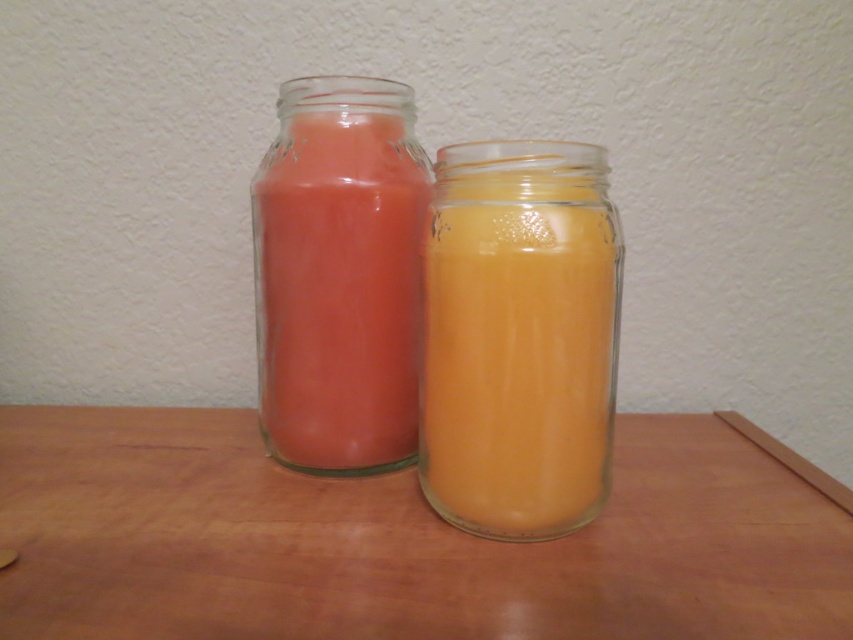
Which is above, wooden table at center or translucent glass candle at center?

Positioned higher is translucent glass candle at center.

Does wooden table at center appear on the right side of translucent glass candle at center?

In fact, wooden table at center is to the left of translucent glass candle at center.

Which is in front, point (828, 529) or point (457, 445)?

Point (457, 445)

This screenshot has height=640, width=853. What are the coordinates of `wooden table at center` in the screenshot? It's located at [396, 541].

Does point (198, 609) lie behind point (335, 464)?

No, (198, 609) is in front of (335, 464).

Between wooden table at center and matte glass jar at center, which one appears on the left side from the viewer's perspective?

wooden table at center

I want to click on wooden table at center, so click(396, 541).

Is point (508, 461) positioned after point (323, 365)?

No.

Image resolution: width=853 pixels, height=640 pixels. Find the location of `translucent glass candle at center`. translucent glass candle at center is located at coordinates (519, 337).